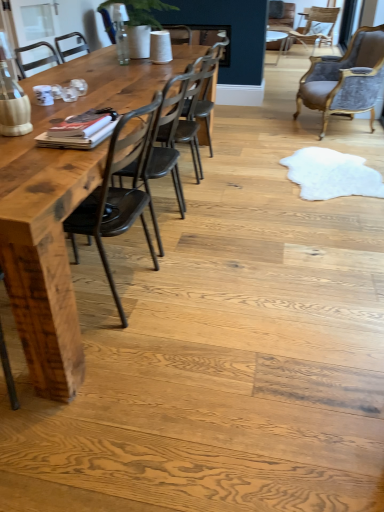
Question: Can you confirm if velvet upholstered chair at upper right, which is counted as the 1th chair, starting from the back, is shorter than dark brown wood chair at center, the first chair when ordered from front to back?

Choices:
 (A) yes
 (B) no

Answer: (A)

Question: Is velvet upholstered chair at upper right, which appears as the 1th chair when viewed from the top, at the right side of dark brown wood chair at center, placed as the first chair when sorted from bottom to top?

Choices:
 (A) yes
 (B) no

Answer: (A)

Question: Can you confirm if velvet upholstered chair at upper right, which is counted as the 4th chair, starting from the front, is wider than dark brown wood chair at center, placed as the first chair when sorted from bottom to top?

Choices:
 (A) no
 (B) yes

Answer: (B)

Question: Considering the relative sizes of velvet upholstered chair at upper right, which appears as the 1th chair when viewed from the top, and dark brown wood chair at center, the 4th chair from the right, in the image provided, is velvet upholstered chair at upper right, which appears as the 1th chair when viewed from the top, bigger than dark brown wood chair at center, the 4th chair from the right,?

Choices:
 (A) no
 (B) yes

Answer: (B)

Question: Is the position of velvet upholstered chair at upper right, which is counted as the 4th chair, starting from the front, more distant than that of dark brown wood chair at center, the first chair when ordered from front to back?

Choices:
 (A) no
 (B) yes

Answer: (B)

Question: Considering the relative positions of velvet grey chair at upper right, placed as the second chair when sorted from right to left, and metallic dark brown chair at center, which is the second chair in bottom-to-top order, in the image provided, is velvet grey chair at upper right, placed as the second chair when sorted from right to left, to the left or to the right of metallic dark brown chair at center, which is the second chair in bottom-to-top order,?

Choices:
 (A) left
 (B) right

Answer: (B)

Question: From a real-world perspective, is velvet grey chair at upper right, the third chair when ordered from front to back, physically located above or below metallic dark brown chair at center, which is the 2th chair from front to back?

Choices:
 (A) above
 (B) below

Answer: (A)

Question: Is point (377, 34) closer or farther from the camera than point (165, 129)?

Choices:
 (A) farther
 (B) closer

Answer: (A)

Question: In terms of height, does velvet grey chair at upper right, which ranks as the 3th chair in left-to-right order, look taller or shorter compared to metallic dark brown chair at center, which is the third chair in back-to-front order?

Choices:
 (A) short
 (B) tall

Answer: (B)

Question: Is metallic dark brown chair at center, which is the third chair in back-to-front order, to the left or to the right of velvet upholstered chair at upper right, which is counted as the 1th chair, starting from the back, in the image?

Choices:
 (A) right
 (B) left

Answer: (B)

Question: Do you think metallic dark brown chair at center, which is the third chair in back-to-front order, is within velvet upholstered chair at upper right, the 4th chair ordered from the bottom, or outside of it?

Choices:
 (A) inside
 (B) outside

Answer: (B)

Question: Considering the positions of metallic dark brown chair at center, the third chair in the top-to-bottom sequence, and velvet upholstered chair at upper right, the 4th chair when ordered from left to right, in the image, is metallic dark brown chair at center, the third chair in the top-to-bottom sequence, bigger or smaller than velvet upholstered chair at upper right, the 4th chair when ordered from left to right,?

Choices:
 (A) small
 (B) big

Answer: (A)

Question: In terms of width, does metallic dark brown chair at center, which is the 2th chair from front to back, look wider or thinner when compared to velvet upholstered chair at upper right, which appears as the 1th chair when viewed from the top?

Choices:
 (A) thin
 (B) wide

Answer: (A)

Question: Considering the positions of velvet upholstered chair at upper right, the 4th chair when ordered from left to right, and wooden table at left in the image, is velvet upholstered chair at upper right, the 4th chair when ordered from left to right, wider or thinner than wooden table at left?

Choices:
 (A) wide
 (B) thin

Answer: (B)

Question: Considering their positions, is velvet upholstered chair at upper right, the 4th chair ordered from the bottom, located in front of or behind wooden table at left?

Choices:
 (A) front
 (B) behind

Answer: (B)